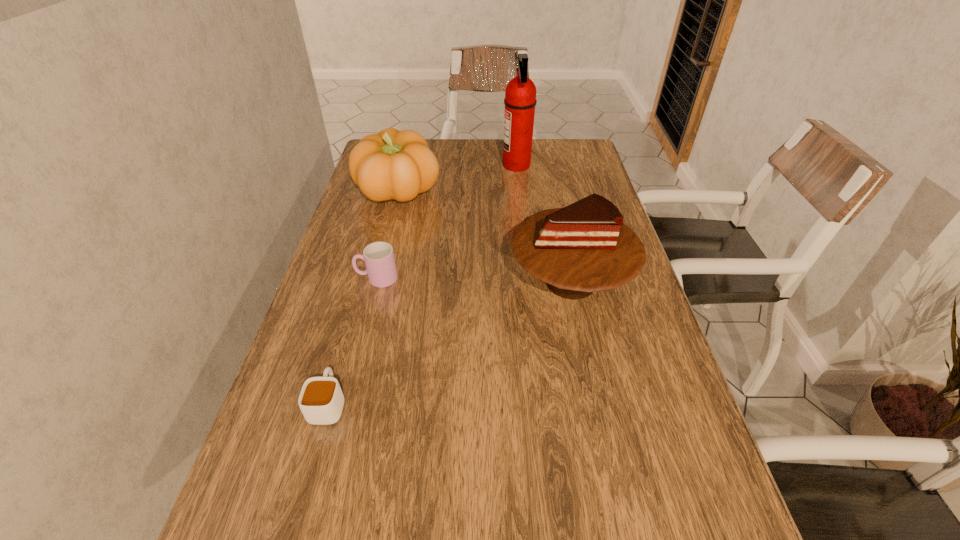
This screenshot has height=540, width=960. I want to click on the tallest object, so click(x=520, y=100).

This screenshot has width=960, height=540. Find the location of `pumpkin`. pumpkin is located at coordinates (393, 164).

Locate an element on the screen. Image resolution: width=960 pixels, height=540 pixels. cake is located at coordinates (582, 248).

The height and width of the screenshot is (540, 960). What are the coordinates of `the fourth tallest object` in the screenshot? It's located at (379, 259).

Locate an element on the screen. the farther cup is located at coordinates (379, 259).

This screenshot has height=540, width=960. I want to click on the nearest object, so click(x=321, y=400).

Locate an element on the screen. This screenshot has height=540, width=960. the nearer cup is located at coordinates (321, 400).

This screenshot has height=540, width=960. Identify the location of vacant region located 0.350m on the side of the tallest object near the handle. tap(398, 165).

Locate an element on the screen. The image size is (960, 540). free space located on the side of the tallest object near the handle is located at coordinates [x=425, y=165].

Identify the location of blank area located 0.190m on the side of the tallest object near the handle. The height and width of the screenshot is (540, 960). (445, 165).